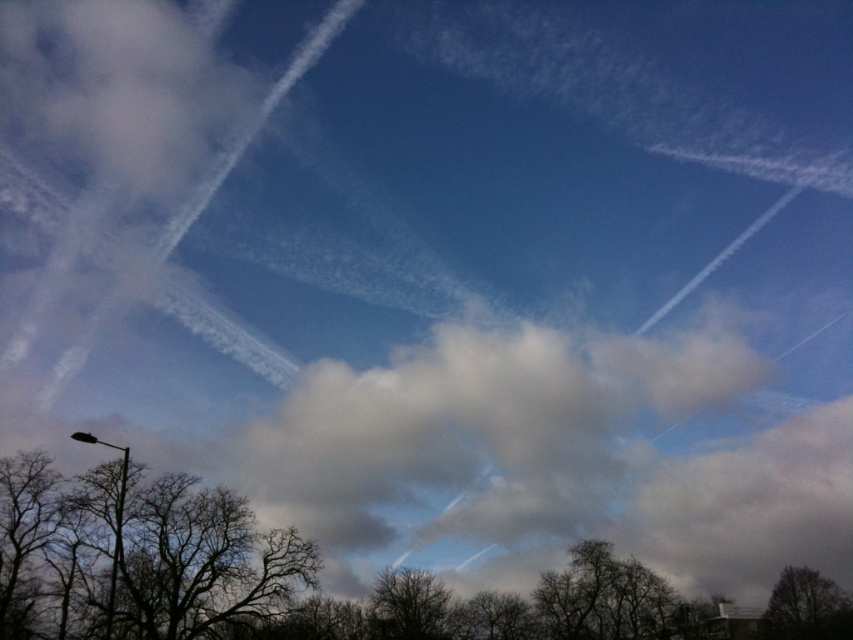
Between dark brown textured tree at lower right and black metal lamp post at lower left, which one has more height?

black metal lamp post at lower left is taller.

Is the position of dark brown textured tree at lower right more distant than that of black metal lamp post at lower left?

Yes.

Between point (782, 616) and point (114, 588), which one is positioned behind?

Positioned behind is point (782, 616).

Find the location of a particular element. This screenshot has height=640, width=853. dark brown textured tree at lower right is located at coordinates (807, 608).

How distant is dark brown textured tree at lower center from black metal lamp post at lower left?

dark brown textured tree at lower center and black metal lamp post at lower left are 23.30 meters apart from each other.

Can you confirm if dark brown textured tree at lower center is taller than black metal lamp post at lower left?

In fact, dark brown textured tree at lower center may be shorter than black metal lamp post at lower left.

In order to click on dark brown textured tree at lower center in this screenshot , I will do `click(408, 605)`.

Is point (851, 605) positioned behind point (392, 579)?

Yes, it is behind point (392, 579).

Image resolution: width=853 pixels, height=640 pixels. I want to click on dark brown textured tree at lower right, so click(807, 608).

Where is `dark brown textured tree at lower right`? The height and width of the screenshot is (640, 853). dark brown textured tree at lower right is located at coordinates (807, 608).